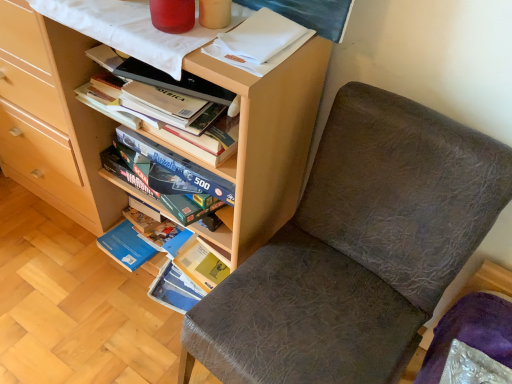
Question: Should I look upward or downward to see matte wood bookcase at center?

Choices:
 (A) up
 (B) down

Answer: (A)

Question: Should I look upward or downward to see brown leather chair at center?

Choices:
 (A) down
 (B) up

Answer: (A)

Question: Does matte wood bookcase at center come behind brown leather chair at center?

Choices:
 (A) no
 (B) yes

Answer: (B)

Question: From a real-world perspective, is matte wood bookcase at center physically above brown leather chair at center?

Choices:
 (A) no
 (B) yes

Answer: (B)

Question: Considering the relative positions of matte wood bookcase at center and brown leather chair at center in the image provided, is matte wood bookcase at center to the right of brown leather chair at center from the viewer's perspective?

Choices:
 (A) yes
 (B) no

Answer: (B)

Question: From the image's perspective, does matte wood bookcase at center appear higher than brown leather chair at center?

Choices:
 (A) yes
 (B) no

Answer: (A)

Question: Is matte wood bookcase at center not within brown leather chair at center?

Choices:
 (A) no
 (B) yes

Answer: (B)

Question: Is matte wood bookcase at center with brown leather chair at center?

Choices:
 (A) no
 (B) yes

Answer: (A)

Question: Is brown leather chair at center turned away from matte wood bookcase at center?

Choices:
 (A) yes
 (B) no

Answer: (B)

Question: From a real-world perspective, is brown leather chair at center below matte wood bookcase at center?

Choices:
 (A) yes
 (B) no

Answer: (A)

Question: Is brown leather chair at center outside matte wood bookcase at center?

Choices:
 (A) no
 (B) yes

Answer: (B)

Question: Can you confirm if brown leather chair at center is taller than matte wood bookcase at center?

Choices:
 (A) no
 (B) yes

Answer: (A)

Question: Does brown leather chair at center turn towards matte wood bookcase at center?

Choices:
 (A) yes
 (B) no

Answer: (B)

Question: Does brown leather chair at center have a smaller size compared to matte wood bookcase at center?

Choices:
 (A) no
 (B) yes

Answer: (B)

Question: Choose the correct answer: Is matte wood bookcase at center inside brown leather chair at center or outside it?

Choices:
 (A) inside
 (B) outside

Answer: (B)